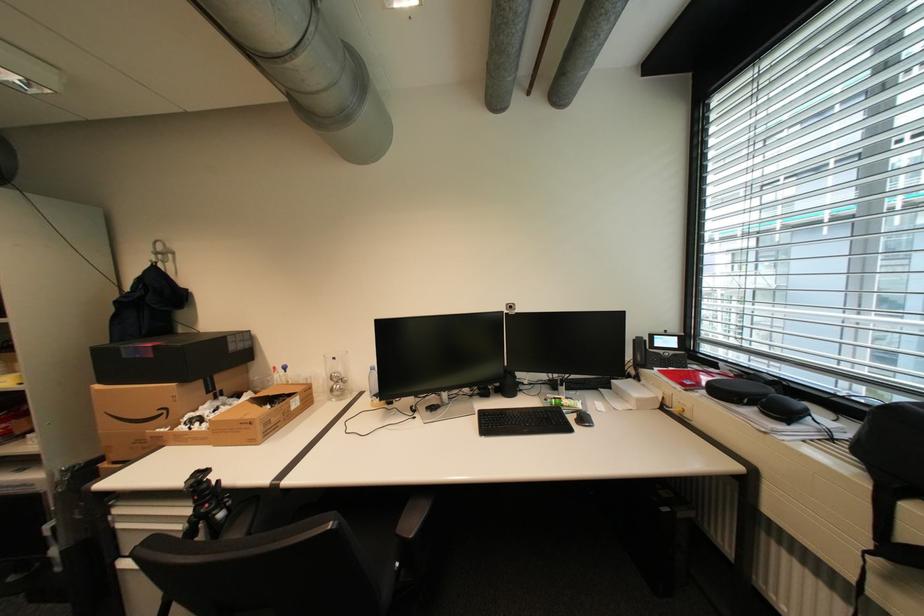
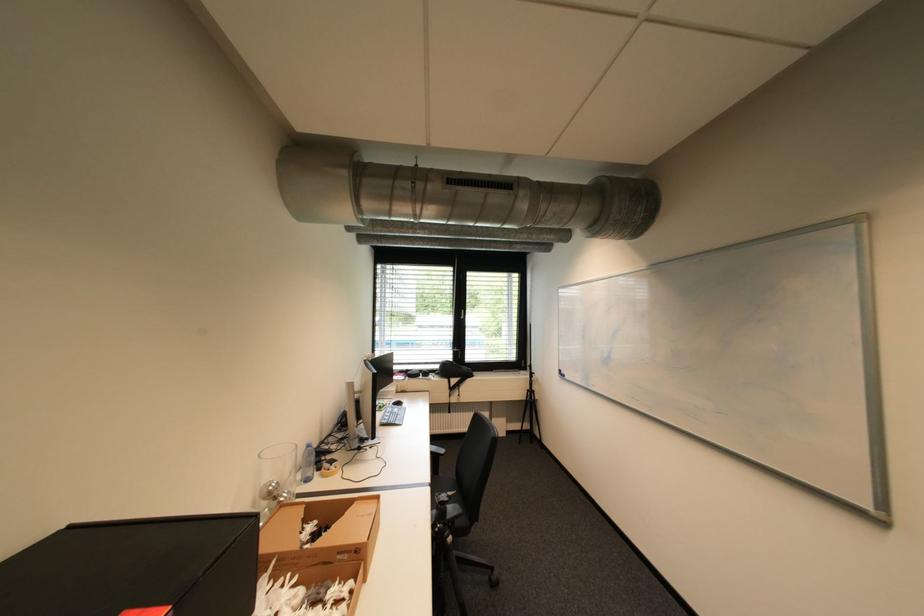
Question: I am providing you with two images of the same scene from different viewpoints. Please identify which objects are invisible in image2.

Choices:
 (A) black chair armrest
 (B) water valve knob
 (C) phone handset
 (D) black tripod

Answer: (C)